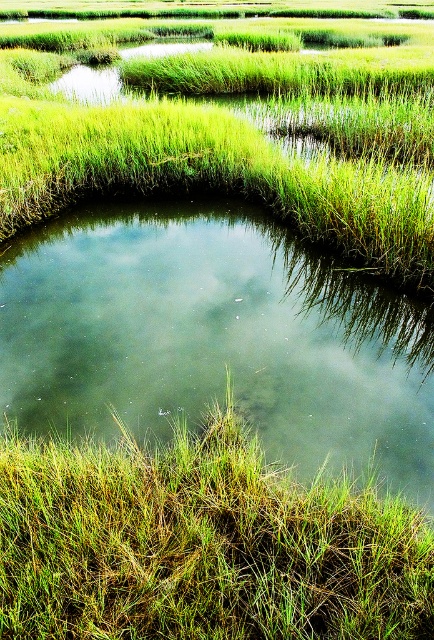
Question: Does green grassy pond at center have a lesser width compared to green grassy at lower left?

Choices:
 (A) no
 (B) yes

Answer: (B)

Question: Does green grassy pond at center appear under green grassy at lower left?

Choices:
 (A) no
 (B) yes

Answer: (A)

Question: Can you confirm if green grassy pond at center is positioned to the left of green grassy at lower left?

Choices:
 (A) yes
 (B) no

Answer: (B)

Question: Which of the following is the closest to the observer?

Choices:
 (A) green grassy at lower left
 (B) green grassy pond at center

Answer: (A)

Question: Which point is closer to the camera?

Choices:
 (A) green grassy pond at center
 (B) green grassy at lower left

Answer: (B)